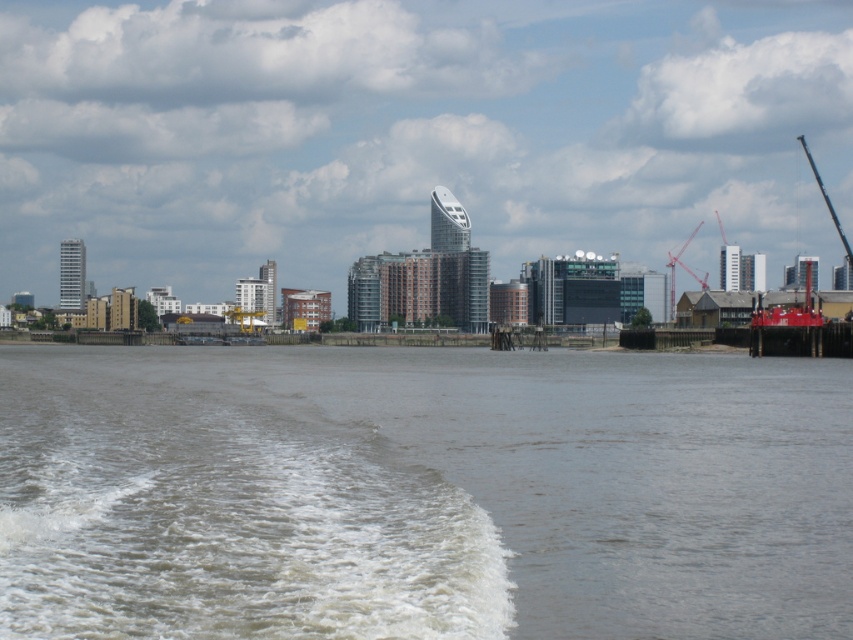
Between point (386, 413) and point (691, 272), which one is positioned behind?

The point (691, 272) is behind.

Is brown muddy water at lower left shorter than metallic red crane at right?

Correct, brown muddy water at lower left is not as tall as metallic red crane at right.

The width and height of the screenshot is (853, 640). Describe the element at coordinates (422, 493) in the screenshot. I see `brown muddy water at lower left` at that location.

Locate an element on the screen. This screenshot has width=853, height=640. brown muddy water at lower left is located at coordinates (422, 493).

You are a GUI agent. You are given a task and a screenshot of the screen. Output one action in this format:
    pyautogui.click(x=<x>, y=<y>)
    Task: Click on the brown muddy water at lower left
    
    Given the screenshot: What is the action you would take?
    pyautogui.click(x=422, y=493)

I want to click on brown muddy water at lower left, so click(x=422, y=493).

You are a GUI agent. You are given a task and a screenshot of the screen. Output one action in this format:
    pyautogui.click(x=<x>, y=<y>)
    Task: Click on the brown muddy water at lower left
    Image resolution: width=853 pixels, height=640 pixels.
    Given the screenshot: What is the action you would take?
    pyautogui.click(x=422, y=493)

Does metallic red crane at right have a greater height compared to metallic gray crane at upper right?

In fact, metallic red crane at right may be shorter than metallic gray crane at upper right.

Is point (666, 257) positioned after point (834, 220)?

Yes, point (666, 257) is farther from viewer.

This screenshot has width=853, height=640. Identify the location of metallic red crane at right. (683, 269).